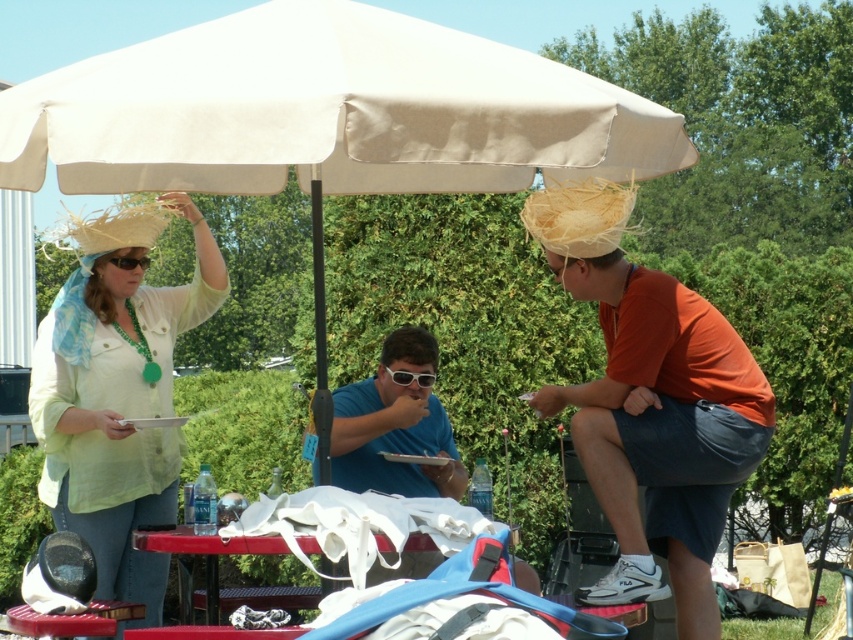
You are a photographer trying to capture a clear shot of both the blue matte shirt at center and the white plastic goggles at center. Since you can only focus on one object at a time, which one should you choose to ensure the other is still somewhat in focus?

The blue matte shirt at center is closer to the viewer than the white plastic goggles at center. To ensure the goggles are somewhat in focus, focus on the blue matte shirt at center because it is closer, and the goggles will be slightly out of focus but still recognizable.